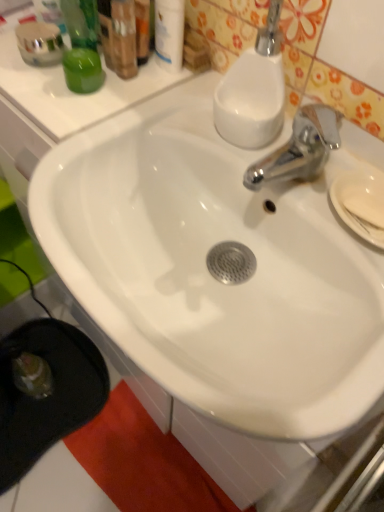
Locate an element on the screen. vacant space that is to the left of white glossy soap dispenser at upper right is located at coordinates (152, 131).